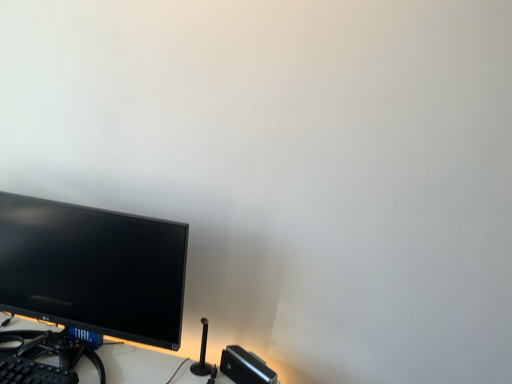
Question: Is matte black monitor at left wider than black plastic keyboard at lower left?

Choices:
 (A) yes
 (B) no

Answer: (B)

Question: Considering the relative sizes of matte black monitor at left and black plastic keyboard at lower left in the image provided, is matte black monitor at left thinner than black plastic keyboard at lower left?

Choices:
 (A) yes
 (B) no

Answer: (A)

Question: Does matte black monitor at left appear on the right side of black plastic keyboard at lower left?

Choices:
 (A) yes
 (B) no

Answer: (A)

Question: Does matte black monitor at left have a lesser height compared to black plastic keyboard at lower left?

Choices:
 (A) no
 (B) yes

Answer: (A)

Question: Would you say matte black monitor at left is outside black plastic keyboard at lower left?

Choices:
 (A) yes
 (B) no

Answer: (A)

Question: Is matte black monitor at left beside black plastic keyboard at lower left?

Choices:
 (A) no
 (B) yes

Answer: (A)

Question: Is matte black monitor at left located within black plastic keyboard at lower left?

Choices:
 (A) yes
 (B) no

Answer: (B)

Question: From the image's perspective, does black plastic keyboard at lower left appear lower than matte black monitor at left?

Choices:
 (A) yes
 (B) no

Answer: (A)

Question: Does black plastic keyboard at lower left have a lesser height compared to matte black monitor at left?

Choices:
 (A) no
 (B) yes

Answer: (B)

Question: Is black plastic keyboard at lower left facing away from matte black monitor at left?

Choices:
 (A) yes
 (B) no

Answer: (A)

Question: Can you confirm if black plastic keyboard at lower left is taller than matte black monitor at left?

Choices:
 (A) yes
 (B) no

Answer: (B)

Question: Is black plastic keyboard at lower left directly adjacent to matte black monitor at left?

Choices:
 (A) no
 (B) yes

Answer: (A)

Question: From a real-world perspective, is black plastic keyboard at lower left positioned above or below matte black monitor at left?

Choices:
 (A) below
 (B) above

Answer: (A)